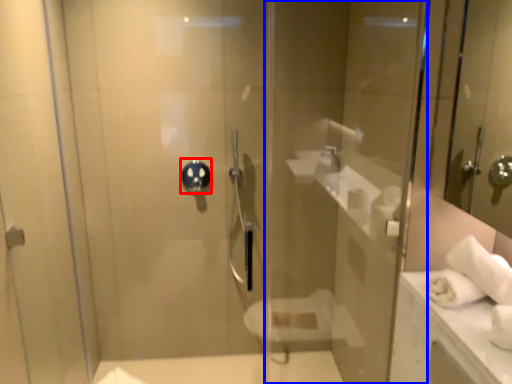
Question: Among these objects, which one is nearest to the camera, shower (highlighted by a red box) or glass door (highlighted by a blue box)?

Choices:
 (A) shower
 (B) glass door

Answer: (B)